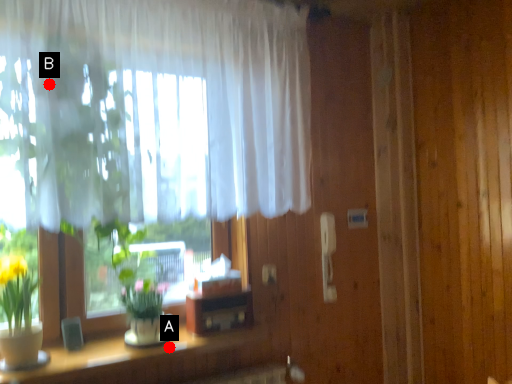
Question: Two points are circled on the image, labeled by A and B beside each circle. Which point appears closest to the camera in this image?

Choices:
 (A) A is closer
 (B) B is closer

Answer: (B)